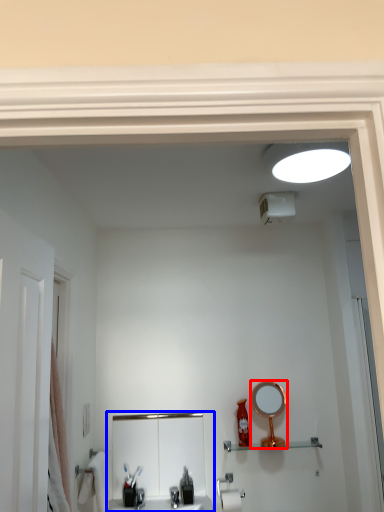
Question: Which point is closer to the camera, mirror (highlighted by a red box) or sink (highlighted by a blue box)?

Choices:
 (A) mirror
 (B) sink

Answer: (B)